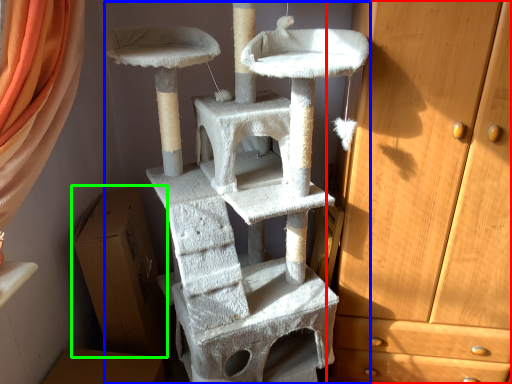
Question: Estimate the real-world distances between objects in this image. Which object is closer to chest of drawers (highlighted by a red box), bunk bed (highlighted by a blue box) or cardboard box (highlighted by a green box)?

Choices:
 (A) bunk bed
 (B) cardboard box

Answer: (A)